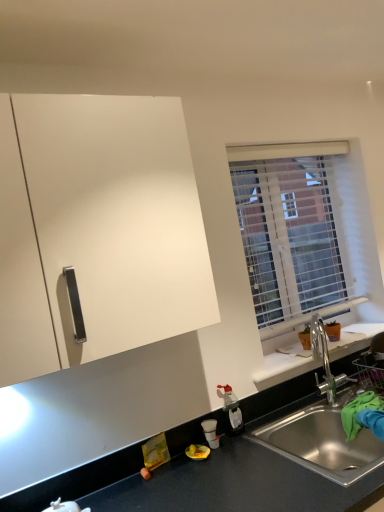
Question: Can we say matte black countertop at lower center lies outside white translucent blinds at upper right?

Choices:
 (A) yes
 (B) no

Answer: (A)

Question: Considering the relative positions of matte black countertop at lower center and white translucent blinds at upper right in the image provided, is matte black countertop at lower center to the left of white translucent blinds at upper right from the viewer's perspective?

Choices:
 (A) yes
 (B) no

Answer: (A)

Question: Is matte black countertop at lower center positioned far away from white translucent blinds at upper right?

Choices:
 (A) yes
 (B) no

Answer: (B)

Question: Does matte black countertop at lower center have a larger size compared to white translucent blinds at upper right?

Choices:
 (A) no
 (B) yes

Answer: (A)

Question: Can you confirm if matte black countertop at lower center is wider than white translucent blinds at upper right?

Choices:
 (A) yes
 (B) no

Answer: (B)

Question: Considering the relative sizes of matte black countertop at lower center and white translucent blinds at upper right in the image provided, is matte black countertop at lower center thinner than white translucent blinds at upper right?

Choices:
 (A) no
 (B) yes

Answer: (B)

Question: From the image's perspective, would you say translucent plastic bottle at lower center is shown under white translucent blinds at upper right?

Choices:
 (A) no
 (B) yes

Answer: (B)

Question: Is translucent plastic bottle at lower center smaller than white translucent blinds at upper right?

Choices:
 (A) no
 (B) yes

Answer: (B)

Question: Does translucent plastic bottle at lower center have a larger size compared to white translucent blinds at upper right?

Choices:
 (A) no
 (B) yes

Answer: (A)

Question: From a real-world perspective, is translucent plastic bottle at lower center under white translucent blinds at upper right?

Choices:
 (A) yes
 (B) no

Answer: (A)

Question: Is translucent plastic bottle at lower center oriented towards white translucent blinds at upper right?

Choices:
 (A) yes
 (B) no

Answer: (B)

Question: Can you confirm if translucent plastic bottle at lower center is positioned to the left of white translucent blinds at upper right?

Choices:
 (A) no
 (B) yes

Answer: (B)

Question: Is white translucent blinds at upper right turned away from matte black countertop at lower center?

Choices:
 (A) yes
 (B) no

Answer: (B)